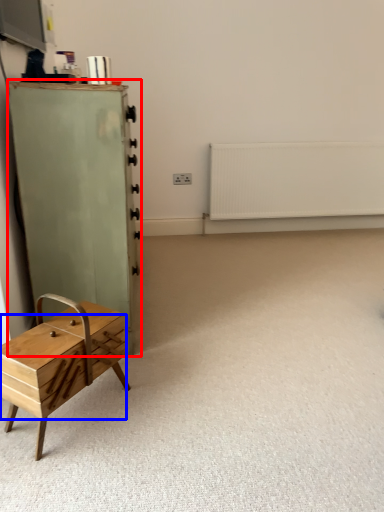
Question: Which point is further to the camera, chest of drawers (highlighted by a red box) or drawer (highlighted by a blue box)?

Choices:
 (A) chest of drawers
 (B) drawer

Answer: (A)